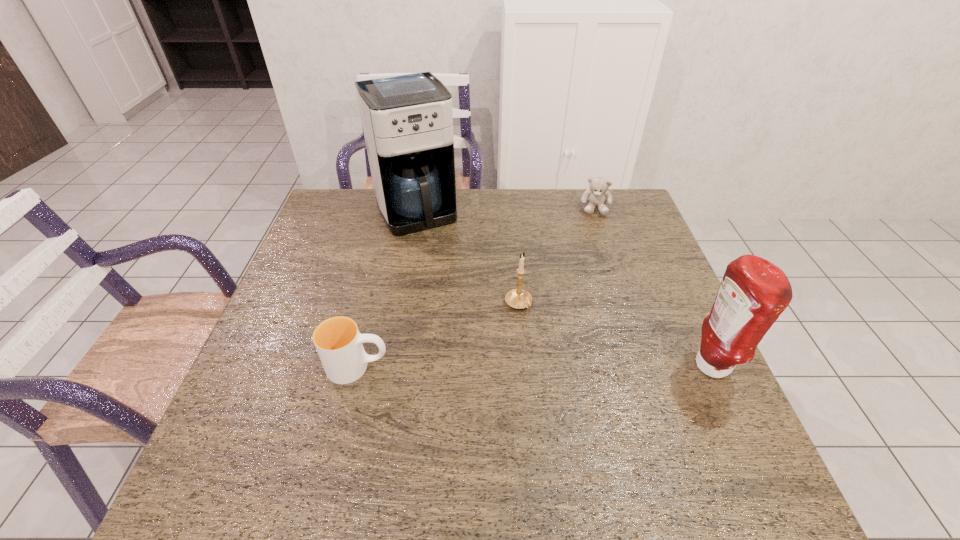
The image size is (960, 540). Identify the location of free spot on the desktop that is between the cup and the fourth shortest object and is positioned on the face of the teddy bear. (587, 366).

Image resolution: width=960 pixels, height=540 pixels. Identify the location of vacant space on the desktop that is between the cup and the fourth shortest object and is positioned on the front panel of the tallest object. (497, 366).

This screenshot has height=540, width=960. I want to click on vacant space on the desktop that is between the cup and the fourth shortest object and is positioned on the handle side of the third nearest object, so click(571, 366).